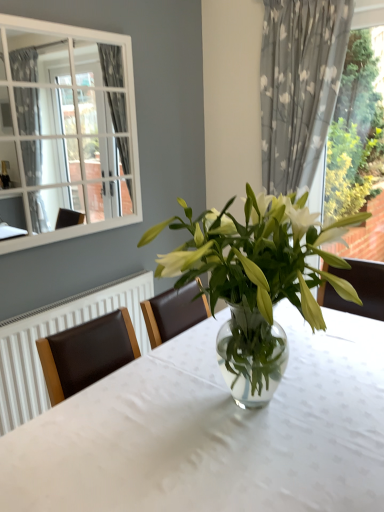
Question: Is transparent glass vase at center aimed at clear glass vase at center?

Choices:
 (A) yes
 (B) no

Answer: (B)

Question: Does transparent glass vase at center have a lesser width compared to clear glass vase at center?

Choices:
 (A) yes
 (B) no

Answer: (B)

Question: From a real-world perspective, does transparent glass vase at center sit lower than clear glass vase at center?

Choices:
 (A) yes
 (B) no

Answer: (A)

Question: Is transparent glass vase at center looking in the opposite direction of clear glass vase at center?

Choices:
 (A) yes
 (B) no

Answer: (B)

Question: Is transparent glass vase at center wider than clear glass vase at center?

Choices:
 (A) yes
 (B) no

Answer: (A)

Question: Is clear glass vase at center located within transparent glass vase at center?

Choices:
 (A) no
 (B) yes

Answer: (A)

Question: From a real-world perspective, is gray floral fabric curtain at right located higher than transparent glass vase at center?

Choices:
 (A) yes
 (B) no

Answer: (A)

Question: Can you confirm if gray floral fabric curtain at right is wider than transparent glass vase at center?

Choices:
 (A) yes
 (B) no

Answer: (B)

Question: Is gray floral fabric curtain at right positioned behind transparent glass vase at center?

Choices:
 (A) yes
 (B) no

Answer: (A)

Question: Does gray floral fabric curtain at right have a lesser height compared to transparent glass vase at center?

Choices:
 (A) yes
 (B) no

Answer: (B)

Question: Does gray floral fabric curtain at right appear on the right side of transparent glass vase at center?

Choices:
 (A) yes
 (B) no

Answer: (A)

Question: Is gray floral fabric curtain at right aimed at transparent glass vase at center?

Choices:
 (A) yes
 (B) no

Answer: (A)

Question: Is transparent glass vase at center aimed at gray floral fabric curtain at right?

Choices:
 (A) no
 (B) yes

Answer: (A)